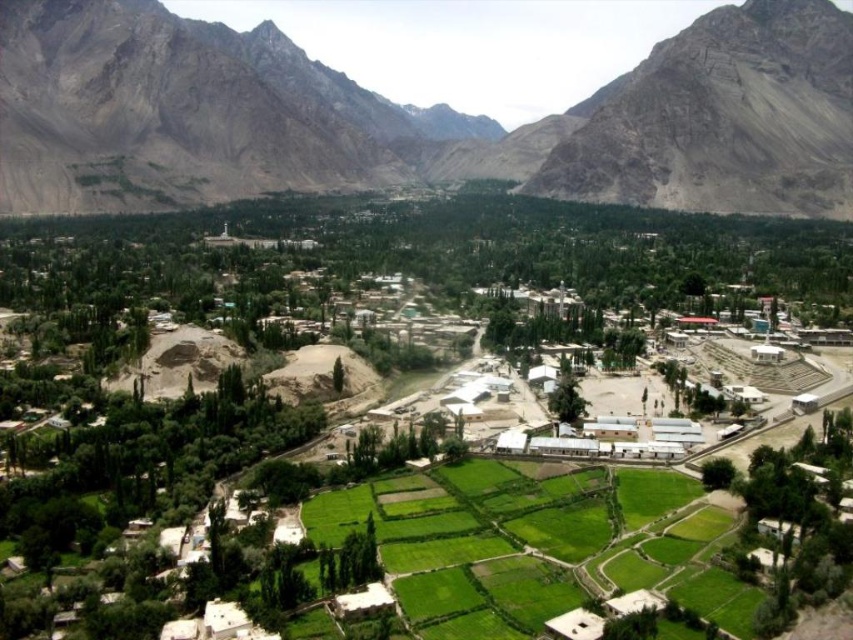
Who is lower down, rugged stone mountain range at center or brown rocky mountain at upper left?

Positioned lower is brown rocky mountain at upper left.

Where is `rugged stone mountain range at center`? The height and width of the screenshot is (640, 853). rugged stone mountain range at center is located at coordinates (412, 116).

Where is `rugged stone mountain range at center`? rugged stone mountain range at center is located at coordinates (412, 116).

You are a GUI agent. You are given a task and a screenshot of the screen. Output one action in this format:
    pyautogui.click(x=<x>, y=<y>)
    Task: Click on the rugged stone mountain range at center
    The image size is (853, 640).
    Given the screenshot: What is the action you would take?
    pyautogui.click(x=412, y=116)